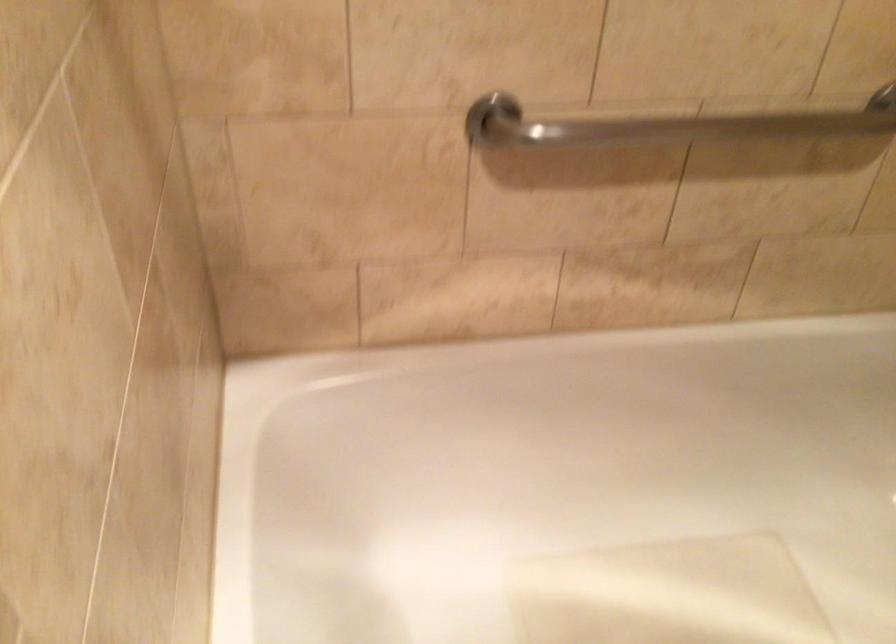
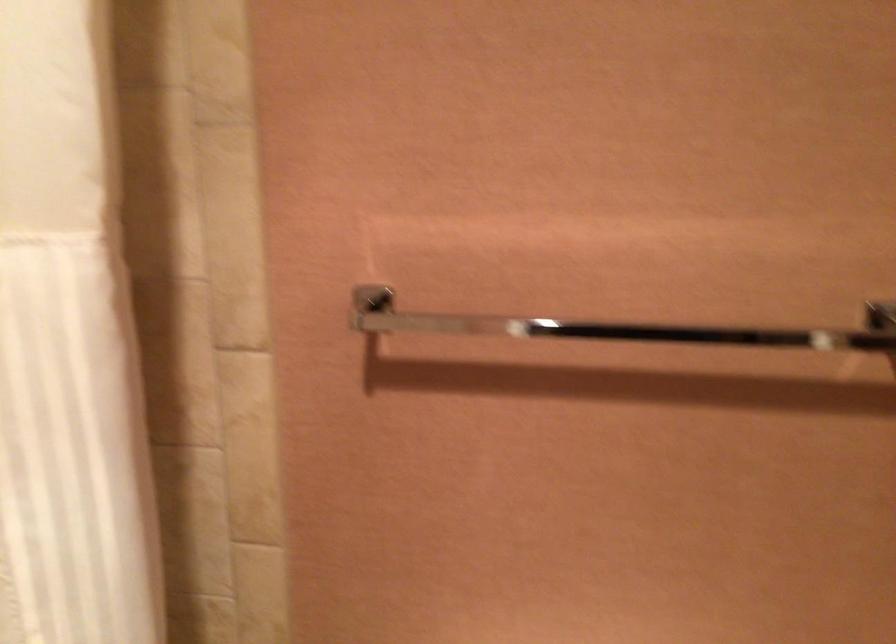
Question: Based on the continuous images, in which direction is the camera rotating? Reply with the corresponding letter.

Choices:
 (A) Left
 (B) Right
 (C) Up
 (D) Down

Answer: (B)